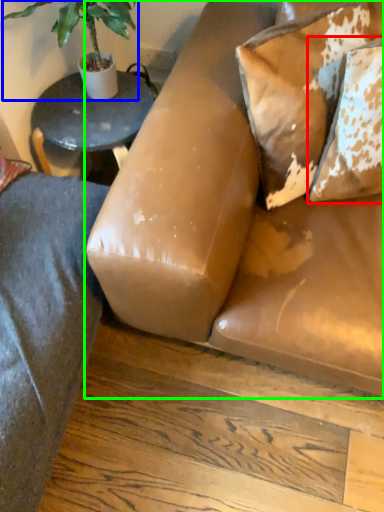
Question: Which object is the closest to the pillow (highlighted by a red box)? Choose among these: houseplant (highlighted by a blue box) or studio couch (highlighted by a green box).

Choices:
 (A) houseplant
 (B) studio couch

Answer: (B)